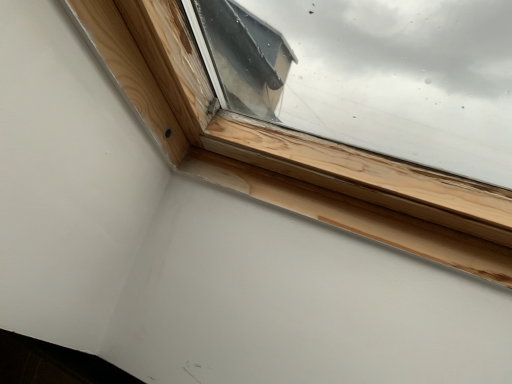
The height and width of the screenshot is (384, 512). I want to click on natural wood window sill at upper right, so click(355, 216).

The height and width of the screenshot is (384, 512). Describe the element at coordinates (355, 216) in the screenshot. I see `natural wood window sill at upper right` at that location.

Locate an element on the screen. This screenshot has width=512, height=384. natural wood window sill at upper right is located at coordinates (355, 216).